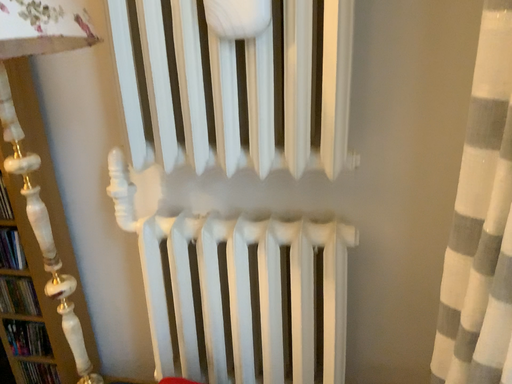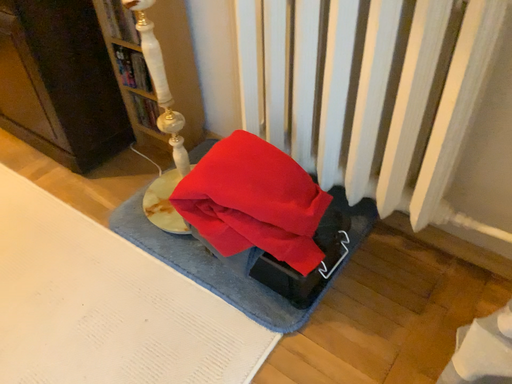
Question: How did the camera likely rotate when shooting the video?

Choices:
 (A) rotated right
 (B) rotated left

Answer: (B)